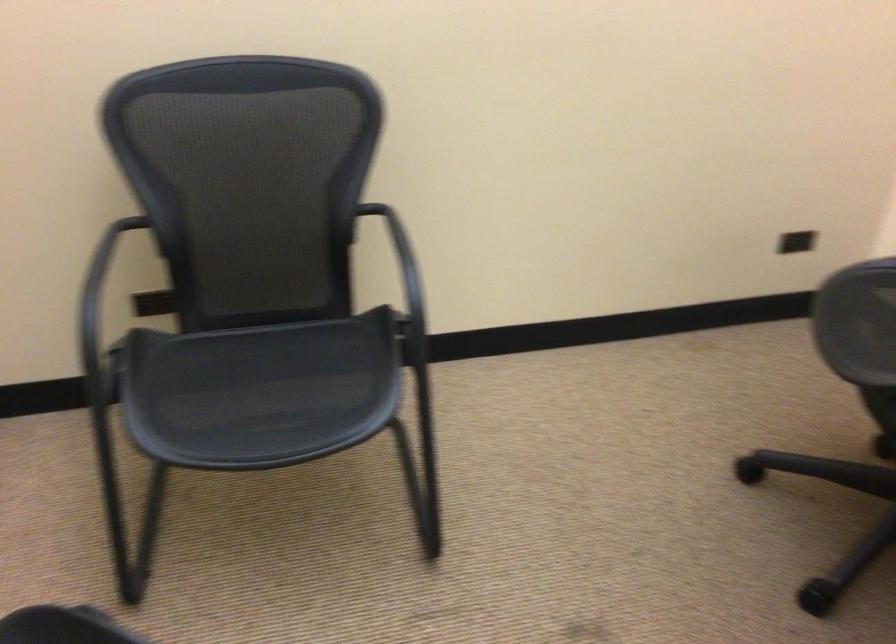
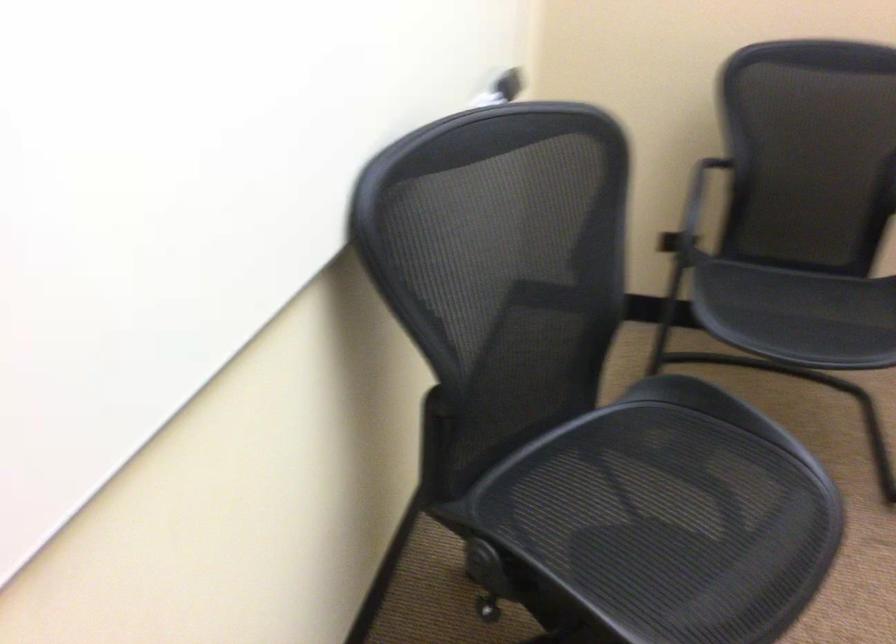
Question: How did the camera likely rotate?

Choices:
 (A) Left
 (B) Right
 (C) Up
 (D) Down

Answer: (A)